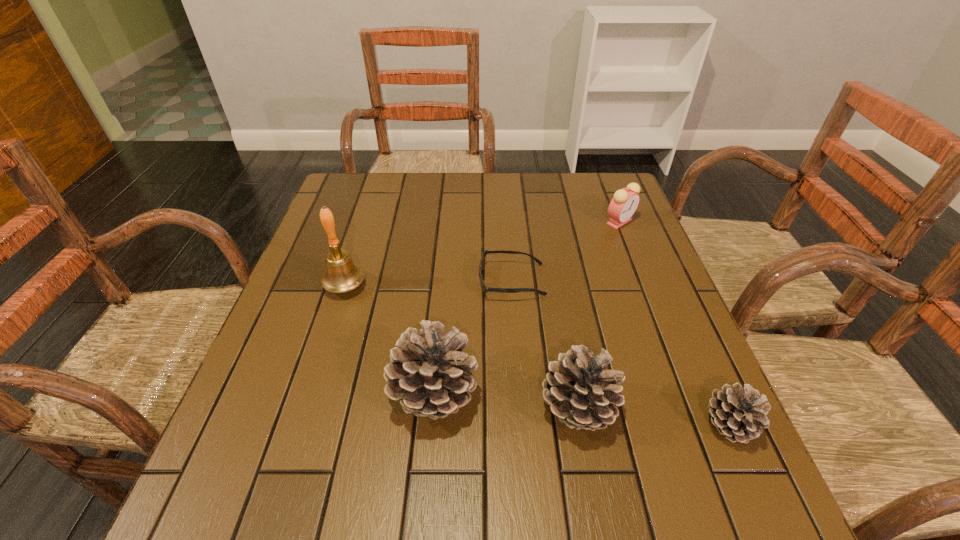
Locate an element on the screen. This screenshot has height=540, width=960. the leftmost pinecone is located at coordinates (427, 372).

The width and height of the screenshot is (960, 540). In order to click on the third tallest object in this screenshot , I will do pos(579,390).

Find the location of a particular element. the second pinecone from right to left is located at coordinates (579, 390).

You are a GUI agent. You are given a task and a screenshot of the screen. Output one action in this format:
    pyautogui.click(x=<x>, y=<y>)
    Task: Click on the shortest pinecone
    The image size is (960, 540).
    Given the screenshot: What is the action you would take?
    pyautogui.click(x=739, y=414)

You are a GUI agent. You are given a task and a screenshot of the screen. Output one action in this format:
    pyautogui.click(x=<x>, y=<y>)
    Task: Click on the farthest object
    Image resolution: width=960 pixels, height=540 pixels.
    Given the screenshot: What is the action you would take?
    pyautogui.click(x=623, y=205)

I want to click on the shortest object, so click(485, 289).

Identify the location of the leftmost object. (342, 275).

At what (x,y) coordinates should I click in order to perform the action: click on the tallest object. Please return your answer as a coordinate pair (x, y). Looking at the image, I should click on (342, 275).

Where is `free space located on the right of the fifth object from right to left`? free space located on the right of the fifth object from right to left is located at coordinates (663, 395).

Locate an element on the screen. vacant point located 0.380m on the left of the fourth shortest object is located at coordinates (332, 409).